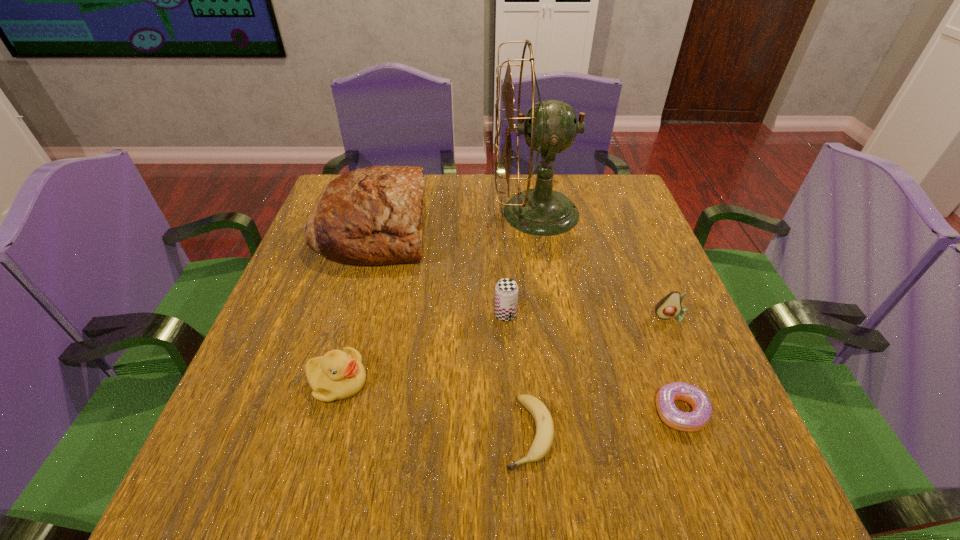
Locate which object ranks third in proximity to the doughnut. Please provide its 2D coordinates. Your answer should be formatted as a tuple, i.e. [(x, y)], where the tuple contains the x and y coordinates of a point satisfying the conditions above.

[(506, 290)]

Where is `vacant region that satisfies the following two spatial constraints: 1. in front of the fan, directing air flow; 2. on the front side of the beer can`? The width and height of the screenshot is (960, 540). vacant region that satisfies the following two spatial constraints: 1. in front of the fan, directing air flow; 2. on the front side of the beer can is located at coordinates (553, 315).

Locate an element on the screen. vacant region that satisfies the following two spatial constraints: 1. on the front side of the beer can; 2. at the face of the duckling is located at coordinates (509, 382).

In order to click on blank space that satisfies the following two spatial constraints: 1. in front of the tallest object, directing air flow; 2. on the front side of the beer can in this screenshot , I will do `click(553, 315)`.

Image resolution: width=960 pixels, height=540 pixels. Find the location of `vacant space that satisfies the following two spatial constraints: 1. in front of the tallest object, directing air flow; 2. on the right side of the second shortest object`. vacant space that satisfies the following two spatial constraints: 1. in front of the tallest object, directing air flow; 2. on the right side of the second shortest object is located at coordinates (569, 411).

The height and width of the screenshot is (540, 960). I want to click on free spot that satisfies the following two spatial constraints: 1. on the back side of the shortest object; 2. at the sliced front of the second tallest object, so click(512, 228).

At what (x,y) coordinates should I click in order to perform the action: click on vacant space that satisfies the following two spatial constraints: 1. at the sliced front of the bread; 2. on the right side of the doughnut. Please return your answer as a coordinate pair (x, y). Looking at the image, I should click on (320, 411).

At what (x,y) coordinates should I click in order to perform the action: click on blank area in the image that satisfies the following two spatial constraints: 1. on the front side of the shortest object; 2. on the left side of the beer can. Please return your answer as a coordinate pair (x, y). This screenshot has height=540, width=960. Looking at the image, I should click on (512, 432).

At what (x,y) coordinates should I click in order to perform the action: click on free space that satisfies the following two spatial constraints: 1. on the seed side of the avocado; 2. at the face of the duckling. Please return your answer as a coordinate pair (x, y). Image resolution: width=960 pixels, height=540 pixels. Looking at the image, I should click on (698, 382).